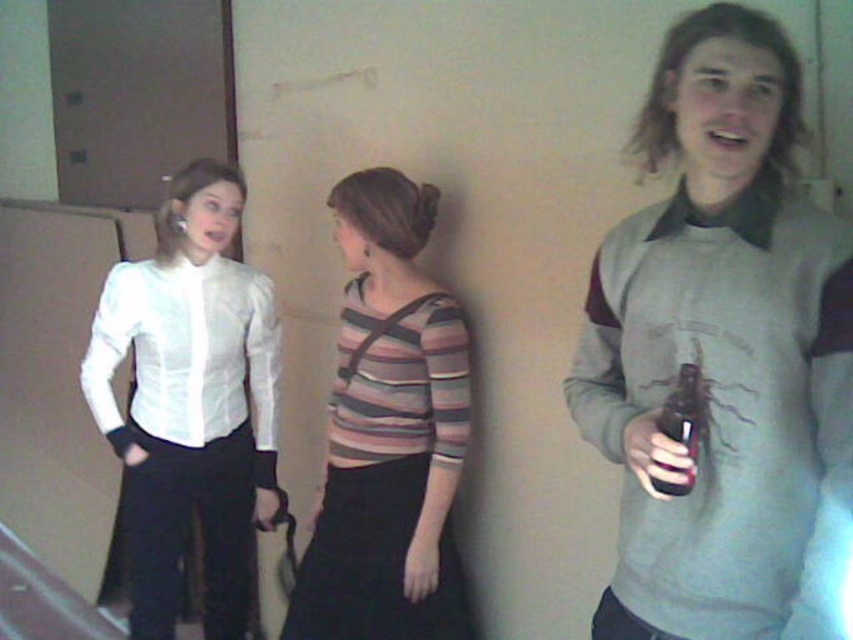
You are organizing a clothing donation drive and need to determine which item takes up more space in the storage bin. Based on the scene, which clothing item between the gray sweater at center and the striped fabric top at center should you prioritize placing first to optimize space?

The striped fabric top at center occupies more space than the gray sweater at center, so you should prioritize placing the striped fabric top at center first to optimize space in the storage bin.

You are organizing a small event and need to arrange the seating so that the gray sweater at center and the translucent plastic bottle at right are placed on a table. If the table has limited space, which object should you prioritize placing first to ensure both can fit?

The gray sweater at center might be wider than the translucent plastic bottle at right, so you should prioritize placing the translucent plastic bottle at right first to accommodate the wider gray sweater at center.

Based on the scene description, which object is bigger between the striped fabric top at center and the translucent plastic bottle at right?

The striped fabric top at center is larger in size than the translucent plastic bottle at right according to the description.